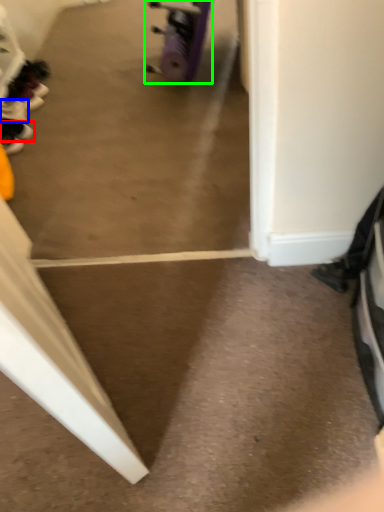
Question: Estimate the real-world distances between objects in this image. Which object is closer to footwear (highlighted by a red box), footwear (highlighted by a blue box) or wheel (highlighted by a green box)?

Choices:
 (A) footwear
 (B) wheel

Answer: (A)